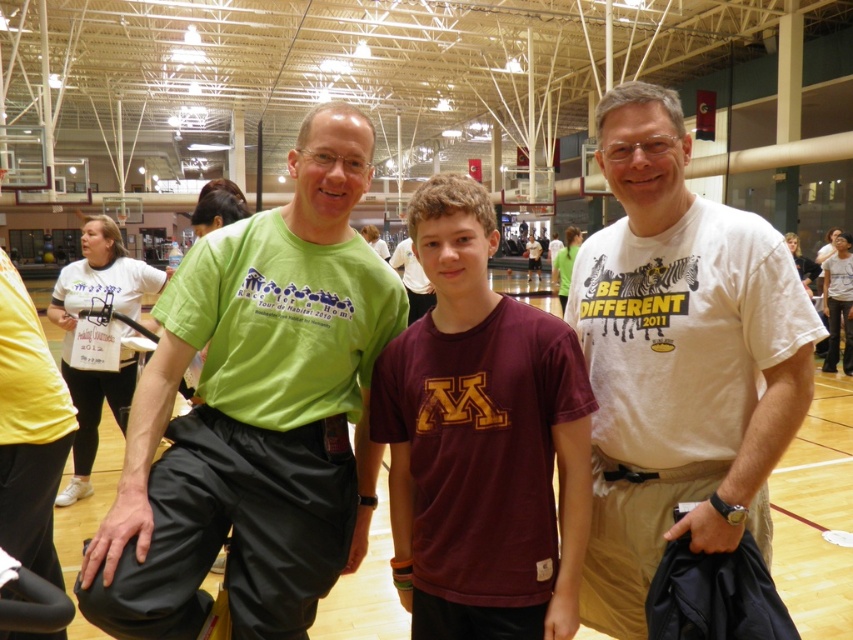
In the scene shown: Between green fabric shirt at left and maroon cotton t-shirt at center, which one appears on the left side from the viewer's perspective?

From the viewer's perspective, green fabric shirt at left appears more on the left side.

Measure the distance between green fabric shirt at left and camera.

green fabric shirt at left and camera are 4.98 feet apart from each other.

The height and width of the screenshot is (640, 853). Identify the location of green fabric shirt at left. (254, 413).

Does green fabric shirt at left appear under white cotton t-shirt at center?

No.

Is point (300, 609) positioned before point (640, 481)?

Yes, it is.

Is point (318, 307) closer to camera compared to point (642, 291)?

No, it is not.

Where is `green fabric shirt at left`? green fabric shirt at left is located at coordinates (254, 413).

Is white cotton t-shirt at center smaller than maroon cotton t-shirt at center?

No, white cotton t-shirt at center is not smaller than maroon cotton t-shirt at center.

Is white cotton t-shirt at center taller than maroon cotton t-shirt at center?

Yes, white cotton t-shirt at center is taller than maroon cotton t-shirt at center.

This screenshot has height=640, width=853. Describe the element at coordinates (679, 360) in the screenshot. I see `white cotton t-shirt at center` at that location.

I want to click on white cotton t-shirt at center, so 679,360.